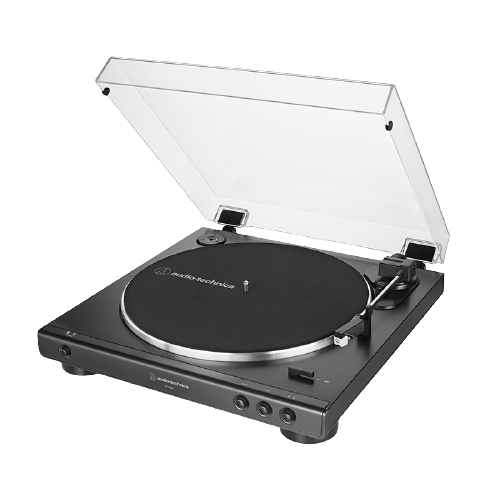
I want to click on turn table, so click(202, 320).